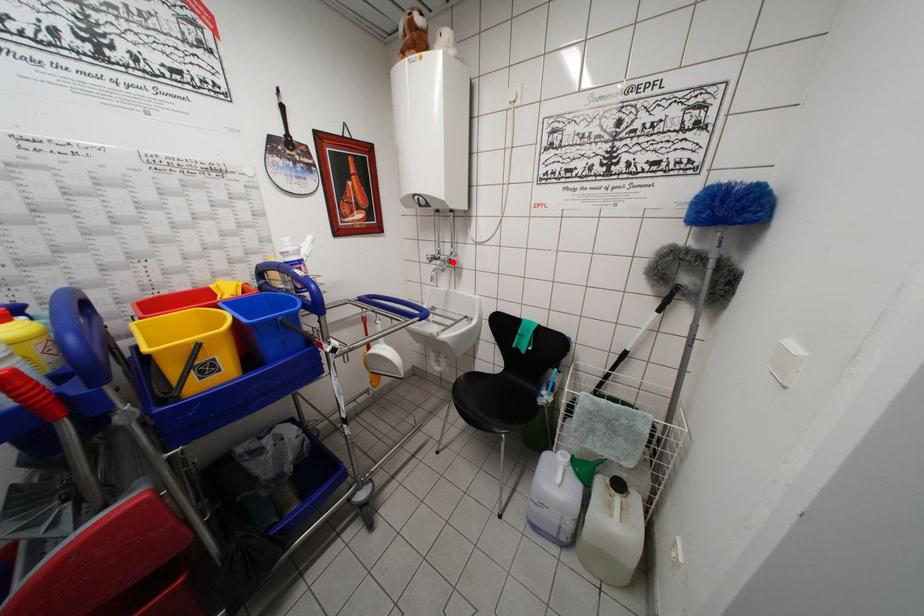
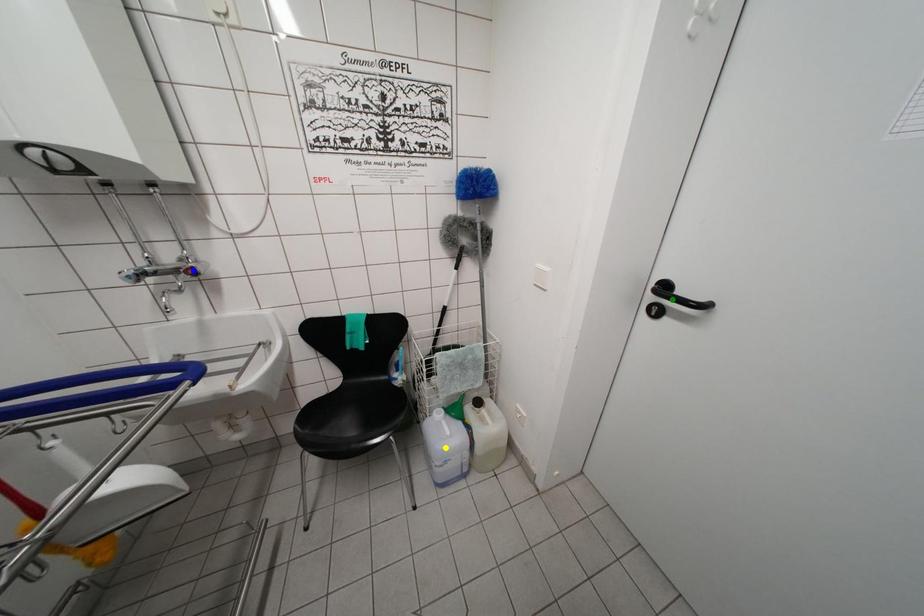
Question: I am providing you with two images of the same scene from different viewpoints. A red point is marked on the first image. You are given multiple points on the second image. Can you choose the point in image 2 that corresponds to the point in image 1?

Choices:
 (A) yellow point
 (B) blue point
 (C) green point

Answer: (B)